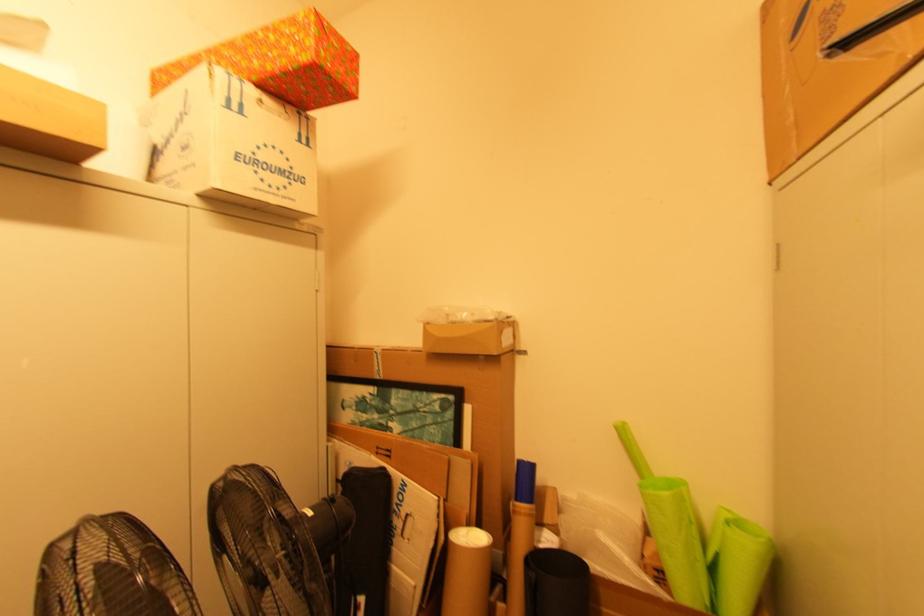
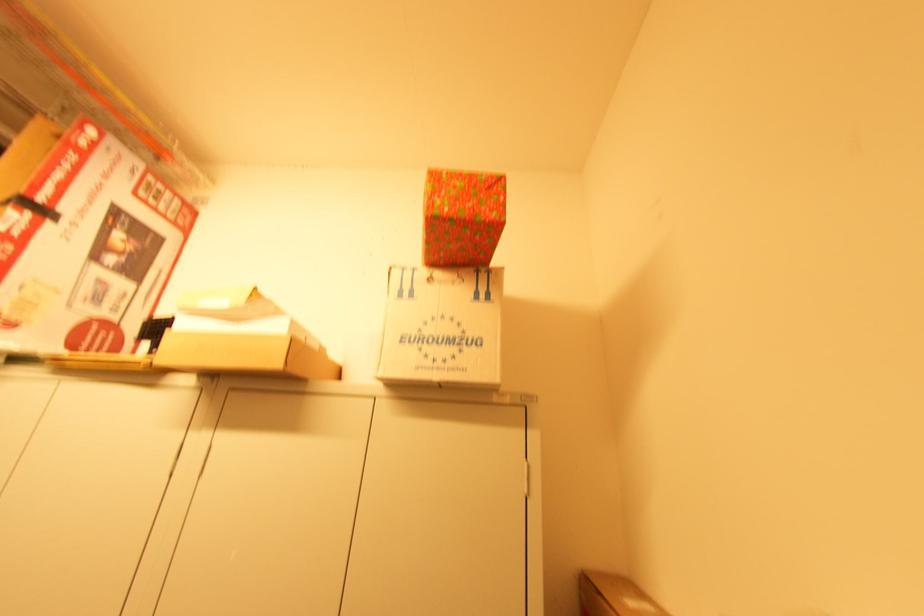
The point at [305,89] is marked in the first image. Where is the corresponding point in the second image?

(454, 246)